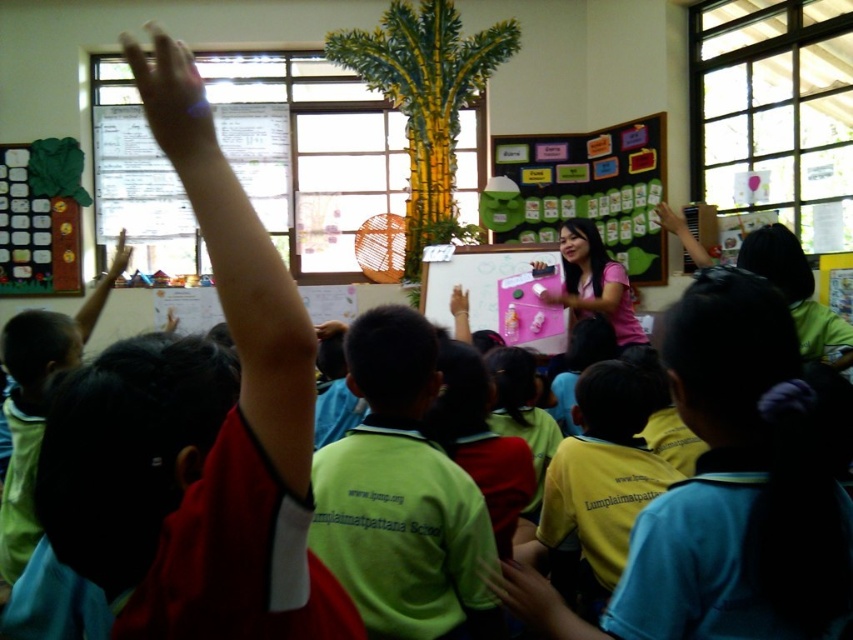
Question: Considering the real-world distances, which object is farthest from the matte skin hand at upper left?

Choices:
 (A) pink matte hand at center
 (B) pink fabric arm at center
 (C) yellow fabric shirt at center
 (D) green shirt at left

Answer: (C)

Question: Is green felt bulletin board at center in front of matte pink dry erase board at center?

Choices:
 (A) no
 (B) yes

Answer: (A)

Question: Is yellow matte shirt at lower center thinner than pink matte hand at center?

Choices:
 (A) no
 (B) yes

Answer: (A)

Question: Estimate the real-world distances between objects in this image. Which object is farther from the smooth skin hand at center?

Choices:
 (A) pink fabric teacher at center
 (B) matte pink arm at upper right

Answer: (B)

Question: Can you confirm if matte red shirt at upper left is positioned to the right of matte pink hand at upper center?

Choices:
 (A) no
 (B) yes

Answer: (A)

Question: Which object appears farthest from the camera in this image?

Choices:
 (A) yellow matte shirt at lower center
 (B) smooth skin hand at center
 (C) matte red arm at upper left

Answer: (A)